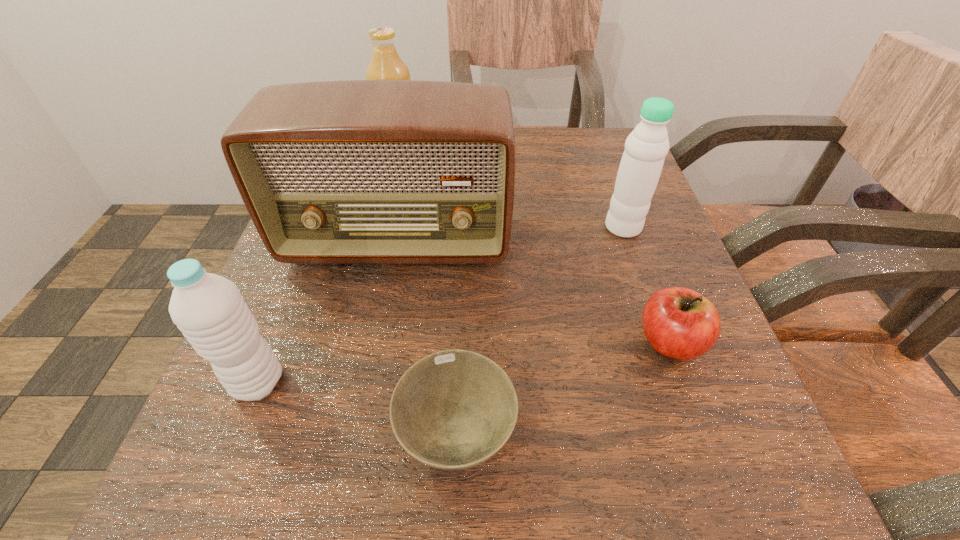
Where is `free spot that satisfies the following two spatial constraints: 1. on the label of the apple; 2. on the left side of the olive oil`? free spot that satisfies the following two spatial constraints: 1. on the label of the apple; 2. on the left side of the olive oil is located at coordinates (356, 342).

Find the location of a particular element. The image size is (960, 540). vacant position in the image that satisfies the following two spatial constraints: 1. on the front-facing side of the second shortest object; 2. on the left side of the radio receiver is located at coordinates (379, 342).

Image resolution: width=960 pixels, height=540 pixels. In order to click on vacant region that satisfies the following two spatial constraints: 1. on the back side of the right water bottle; 2. on the label of the olive oil in this screenshot , I will do `click(599, 158)`.